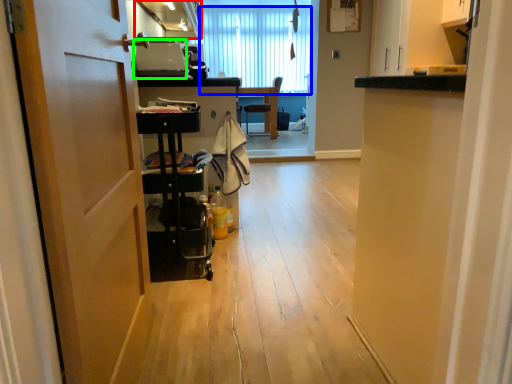
Question: Which object is the closest to the cabinetry (highlighted by a red box)? Choose among these: curtain (highlighted by a blue box) or appliance (highlighted by a green box).

Choices:
 (A) curtain
 (B) appliance

Answer: (B)